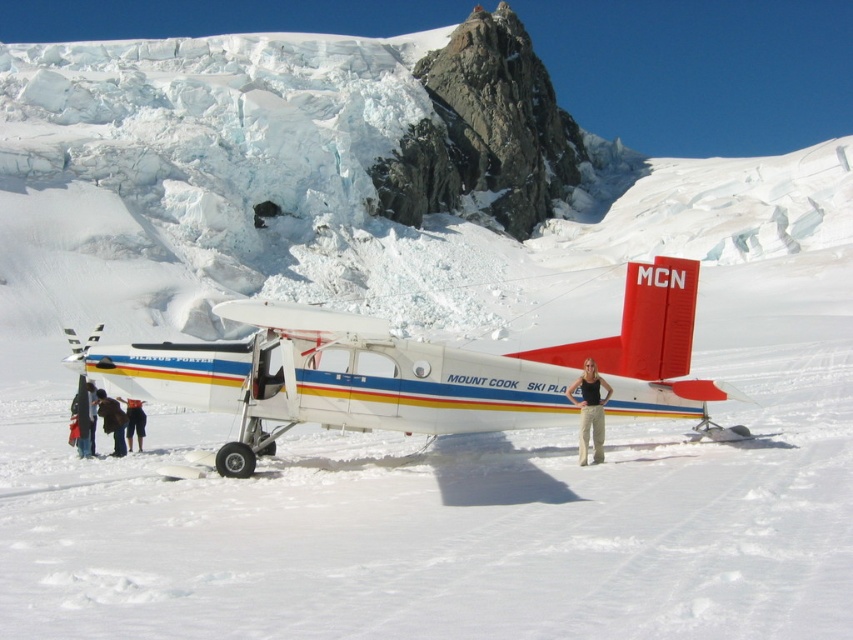
Question: Is dark blue jeans at lower left positioned at the back of dark blue jacket at lower left?

Choices:
 (A) no
 (B) yes

Answer: (B)

Question: Which of the following is the farthest from the observer?

Choices:
 (A) (383, 371)
 (B) (602, 403)

Answer: (A)

Question: Which is farther from the white matte airplane at center?

Choices:
 (A) tan pants at center
 (B) dark blue jacket at lower left
 (C) dark brown leather jacket at lower left
 (D) dark blue jeans at lower left

Answer: (D)

Question: Which point is farther from the camera taking this photo?

Choices:
 (A) coord(112,416)
 (B) coord(126,436)
 (C) coord(508,397)
 (D) coord(589,394)

Answer: (B)

Question: Where is white matte airplane at center located in relation to dark brown leather jacket at lower left in the image?

Choices:
 (A) left
 (B) right

Answer: (B)

Question: Observing the image, what is the correct spatial positioning of dark blue jeans at lower left in reference to dark blue jacket at lower left?

Choices:
 (A) right
 (B) left

Answer: (A)